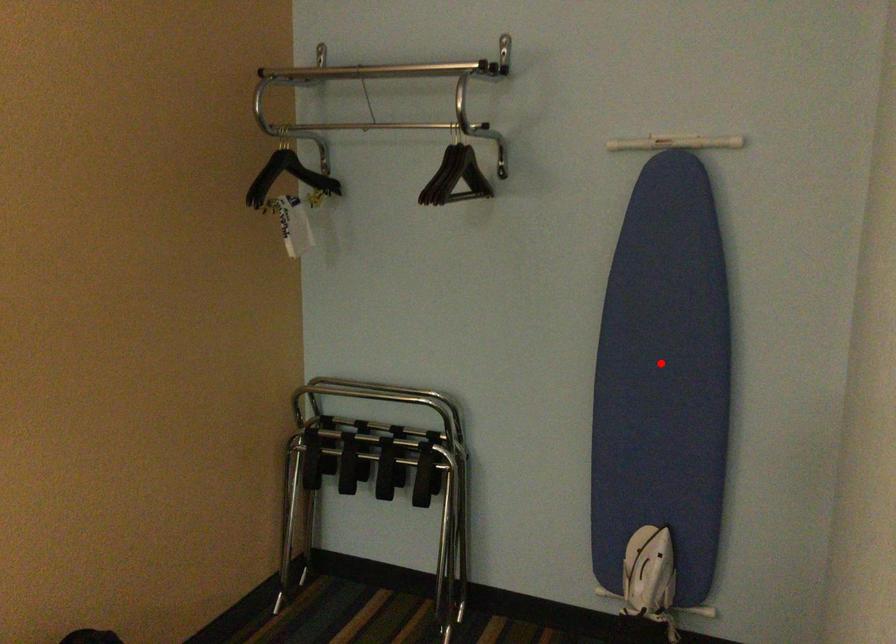
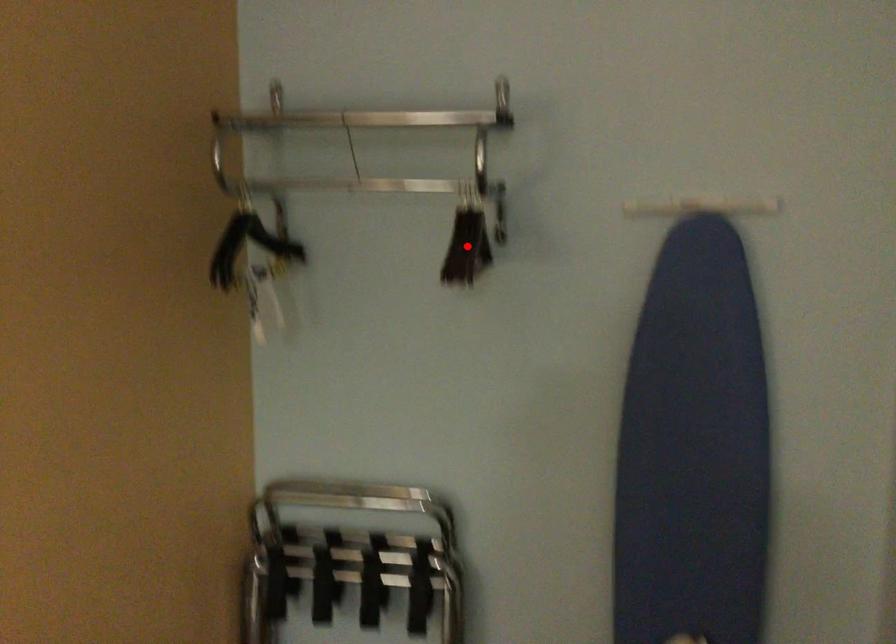
I am providing you with two images of the same scene from different viewpoints. A red point is marked on the first image and another point is marked on the second image. Are the points marked in image1 and image2 representing the same 3D position?

No